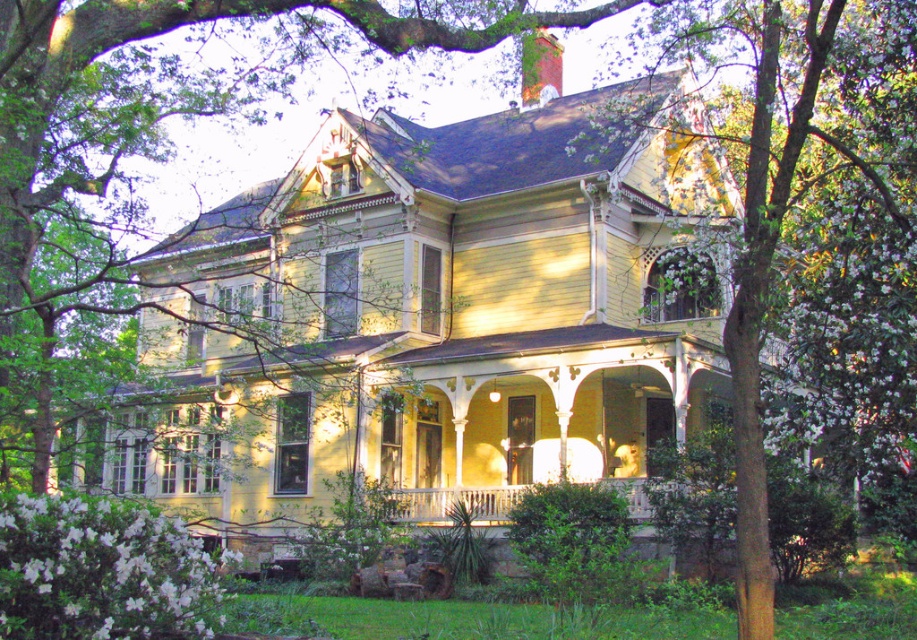
Question: Can you confirm if green leafy tree at center is positioned below white wooden porch at center?

Choices:
 (A) no
 (B) yes

Answer: (A)

Question: In this image, where is green leafy tree at center located relative to white wooden porch at center?

Choices:
 (A) right
 (B) left

Answer: (A)

Question: Which object is closer to the camera taking this photo?

Choices:
 (A) white wooden porch at center
 (B) green leafy tree at center

Answer: (B)

Question: Is green leafy tree at center positioned before white wooden porch at center?

Choices:
 (A) no
 (B) yes

Answer: (B)